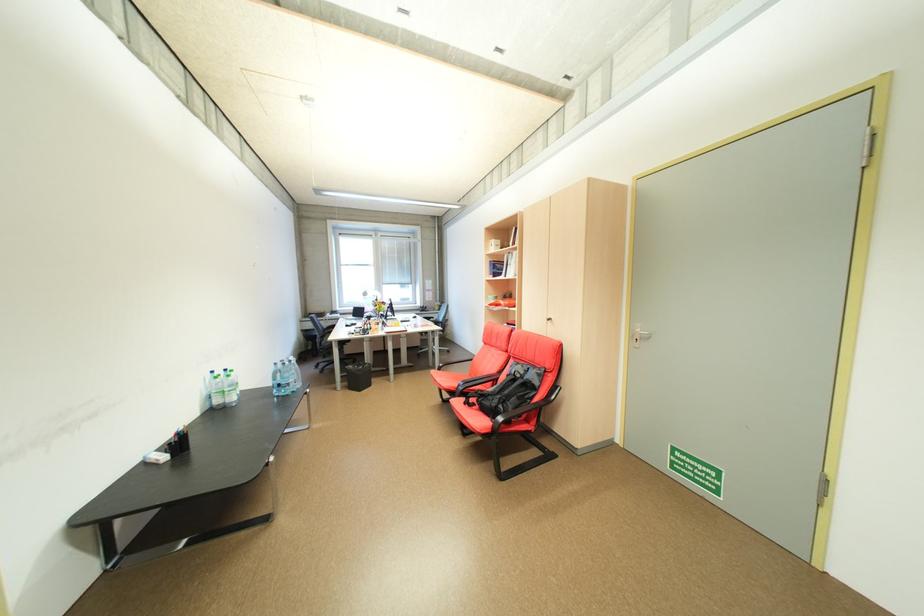
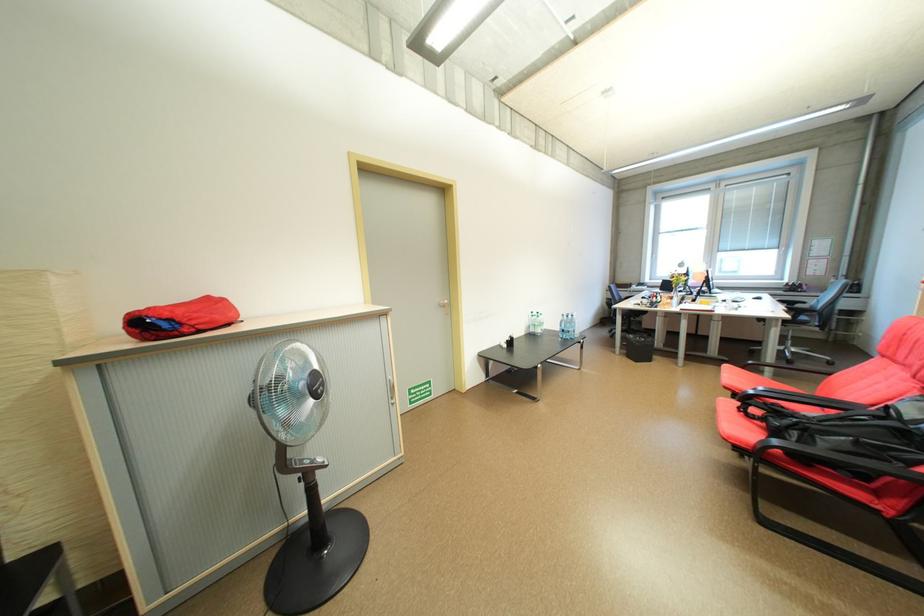
In the second image, find the point that corresponds to point 419,315 in the first image.

(758, 296)